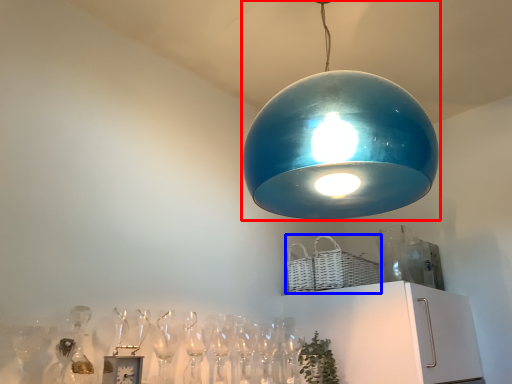
Question: Which point is closer to the camera, lamp (highlighted by a red box) or basket (highlighted by a blue box)?

Choices:
 (A) lamp
 (B) basket

Answer: (A)